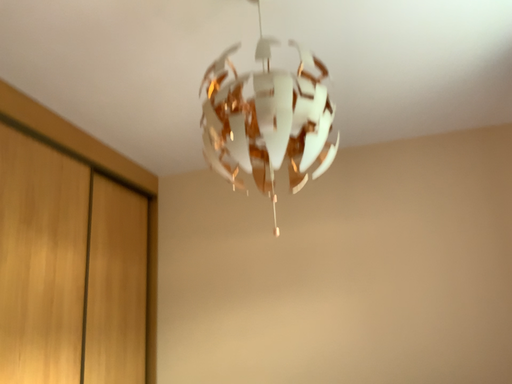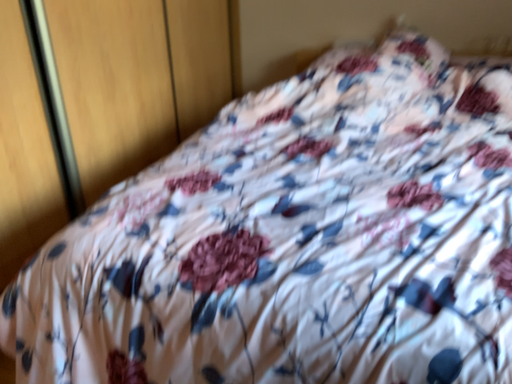
Question: Which way did the camera rotate in the video?

Choices:
 (A) rotated downward
 (B) rotated upward

Answer: (A)